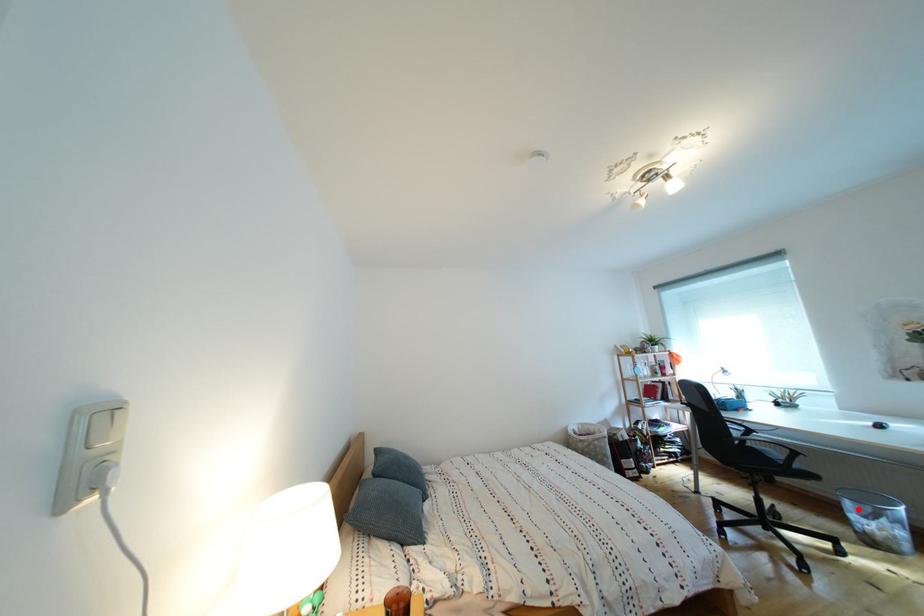
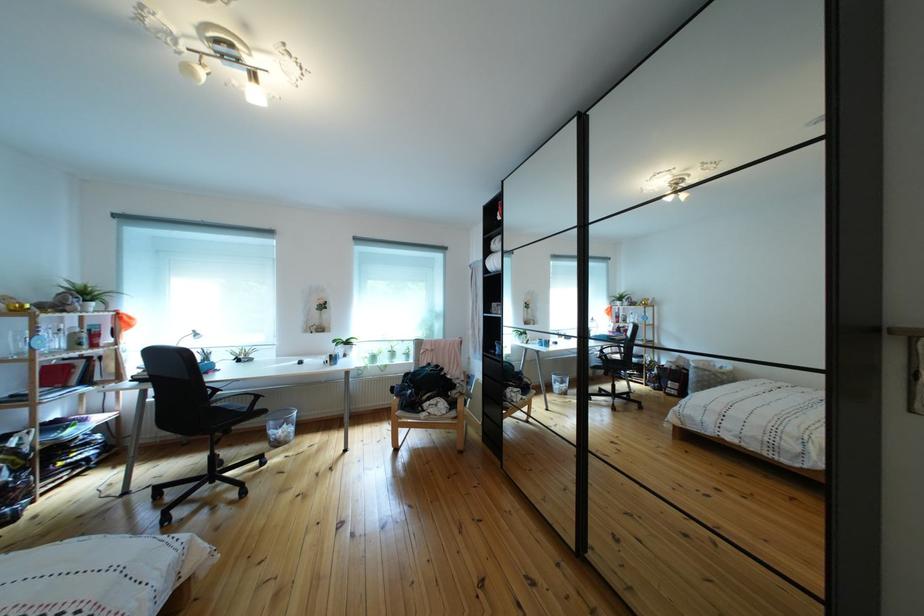
Locate, in the second image, the point that corresponds to the highlighted location in the first image.

(283, 430)